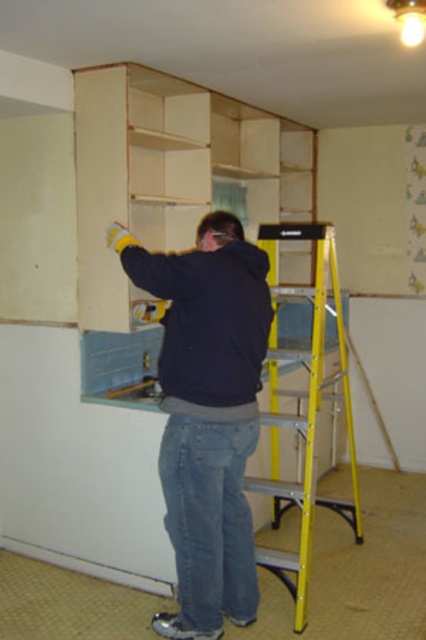
Can you confirm if dark blue jacket at center is wider than yellow metallic ladder at right?

Correct, the width of dark blue jacket at center exceeds that of yellow metallic ladder at right.

Between dark blue jacket at center and yellow metallic ladder at right, which one appears on the right side from the viewer's perspective?

From the viewer's perspective, yellow metallic ladder at right appears more on the right side.

Based on the photo, measure the distance between point (259, 284) and camera.

Point (259, 284) and camera are 2.58 meters apart.

Where is `dark blue jacket at center`? dark blue jacket at center is located at coordinates (207, 413).